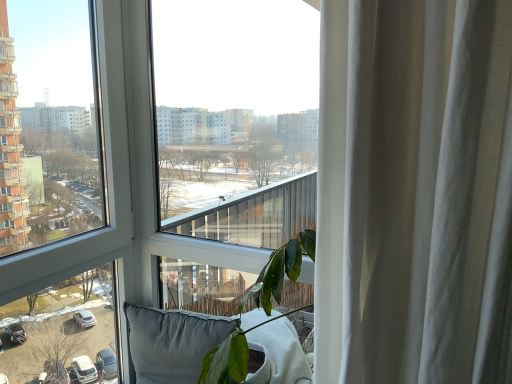
Question: Is gray fabric pillow at lower center to the left or to the right of transparent glass window at center, which is the second window from left to right, in the image?

Choices:
 (A) left
 (B) right

Answer: (A)

Question: From the image's perspective, is gray fabric pillow at lower center positioned above or below transparent glass window at center, positioned as the first window in right-to-left order?

Choices:
 (A) above
 (B) below

Answer: (B)

Question: Which is nearer to the transparent glass window at center, the first window when ordered from left to right?

Choices:
 (A) transparent glass window at center, positioned as the first window in right-to-left order
 (B) gray fabric pillow at lower center

Answer: (A)

Question: Which is nearer to the transparent glass window at center, which is the second window in right-to-left order?

Choices:
 (A) transparent glass window at center, positioned as the first window in right-to-left order
 (B) gray fabric pillow at lower center

Answer: (A)